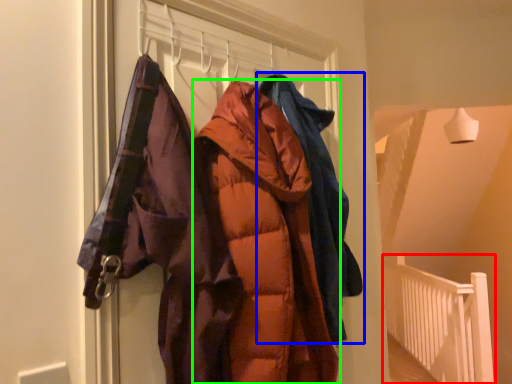
Question: Estimate the real-world distances between objects in this image. Which object is closer to balustrade (highlighted by a red box), jacket (highlighted by a blue box) or jacket (highlighted by a green box)?

Choices:
 (A) jacket
 (B) jacket

Answer: (A)